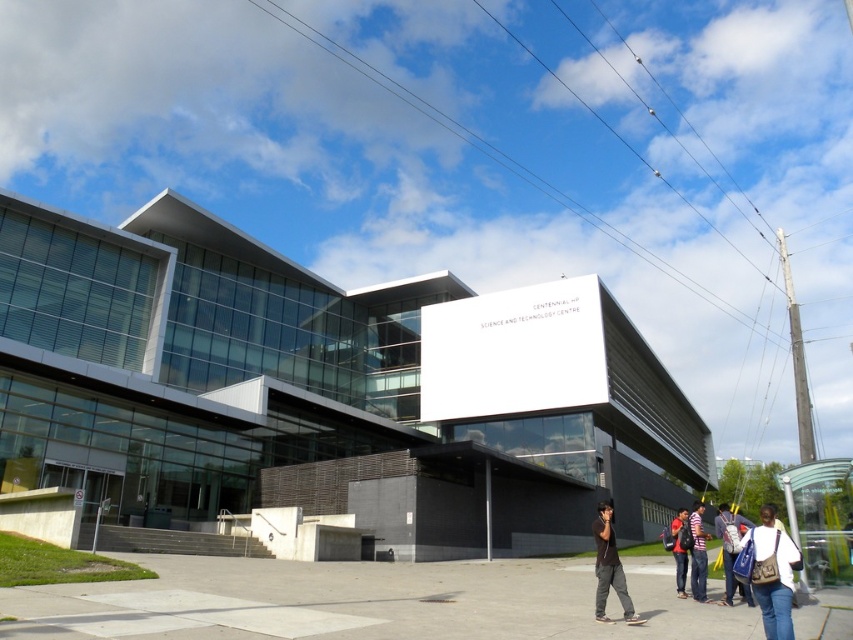
How much distance is there between blue fabric bag at lower right and striped shirt at center?

They are 6.06 meters apart.

Can you confirm if blue fabric bag at lower right is bigger than striped shirt at center?

Indeed, blue fabric bag at lower right has a larger size compared to striped shirt at center.

Between point (722, 522) and point (703, 566), which one is positioned behind?

Positioned behind is point (722, 522).

Where is `blue fabric bag at lower right`? blue fabric bag at lower right is located at coordinates (730, 552).

Which is behind, point (26, 596) or point (602, 531)?

The point (602, 531) is more distant.

Is point (175, 616) in front of point (601, 570)?

Yes, it is.

Find the location of a particular element. gray concrete pavement at lower center is located at coordinates (364, 602).

The width and height of the screenshot is (853, 640). Find the location of `denim jacket at lower right`. denim jacket at lower right is located at coordinates (769, 572).

Describe the element at coordinates (769, 572) in the screenshot. The width and height of the screenshot is (853, 640). I see `denim jacket at lower right` at that location.

This screenshot has width=853, height=640. In order to click on denim jacket at lower right in this screenshot , I will do pos(769,572).